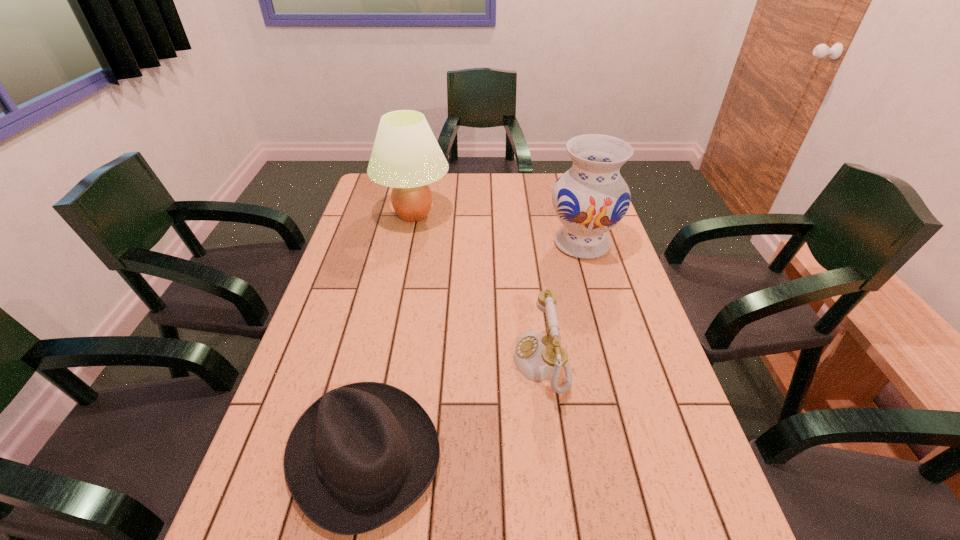
You are a GUI agent. You are given a task and a screenshot of the screen. Output one action in this format:
    pyautogui.click(x=<x>, y=<y>)
    Task: Click on the object that ranks as the closest to the rightmost object
    This screenshot has height=540, width=960.
    Given the screenshot: What is the action you would take?
    pyautogui.click(x=536, y=355)

Identify the location of the second closest object to the rightmost object. (406, 156).

This screenshot has height=540, width=960. I want to click on free spot that satisfies the following two spatial constraints: 1. on the shade of the lampshade; 2. on the back side of the rightmost object, so point(408,244).